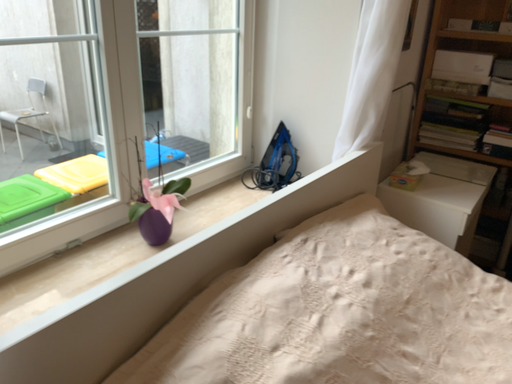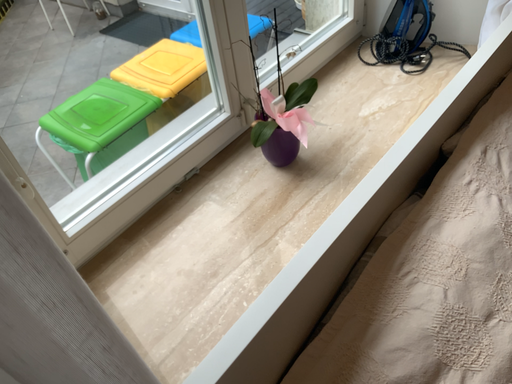
Question: How did the camera likely rotate when shooting the video?

Choices:
 (A) rotated upward
 (B) rotated downward

Answer: (B)